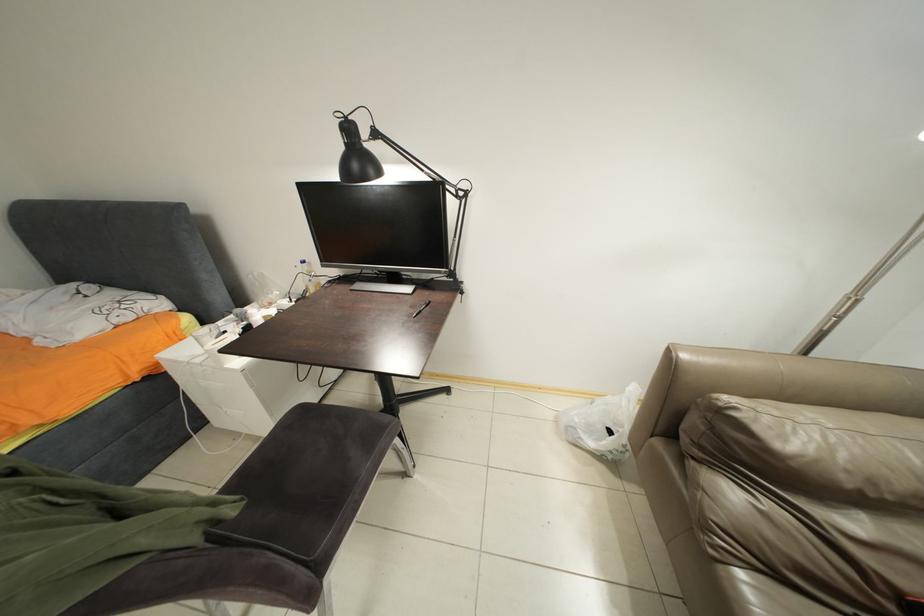
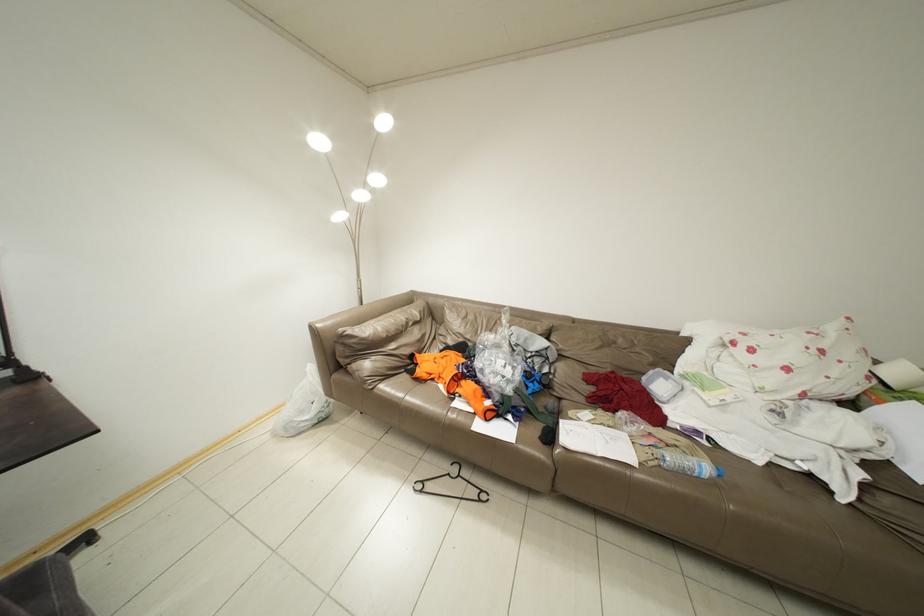
Question: The images are taken continuously from a first-person perspective. In which direction is your viewpoint rotating?

Choices:
 (A) Left
 (B) Right
 (C) Up
 (D) Down

Answer: (B)